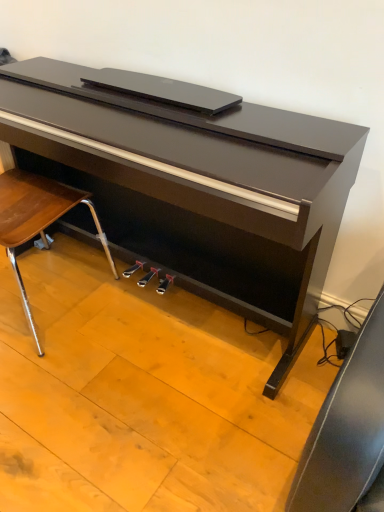
Locate an element on the screen. The height and width of the screenshot is (512, 384). vacant location below wooden/matte chair at lower left (from a real-world perspective) is located at coordinates (40, 305).